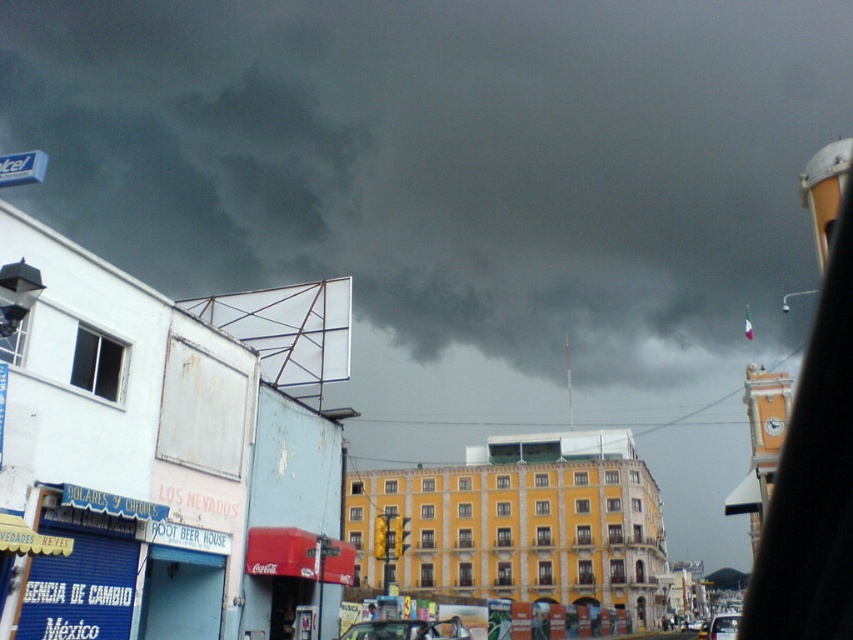
Question: Considering the relative positions of dark gray cloud at upper center and clear glass window at center in the image provided, where is dark gray cloud at upper center located with respect to clear glass window at center?

Choices:
 (A) left
 (B) right

Answer: (B)

Question: Estimate the real-world distances between objects in this image. Which object is farther from the metallic blue street sign at upper left?

Choices:
 (A) clear glass window at center
 (B) dark gray cloud at upper center
 (C) metallic clock tower at upper right
 (D) metallic silver car at center

Answer: (B)

Question: Among these objects, which one is farthest from the camera?

Choices:
 (A) metallic blue street sign at upper left
 (B) dark gray cloud at upper center

Answer: (B)

Question: Which point is closer to the camera taking this photo?

Choices:
 (A) [51, 52]
 (B) [114, 387]
 (C) [712, 637]
 (D) [33, 168]

Answer: (D)

Question: Is metallic clock tower at upper right behind metallic blue street sign at upper left?

Choices:
 (A) yes
 (B) no

Answer: (A)

Question: Is metallic clock tower at upper right bigger than clear glass window at center?

Choices:
 (A) no
 (B) yes

Answer: (B)